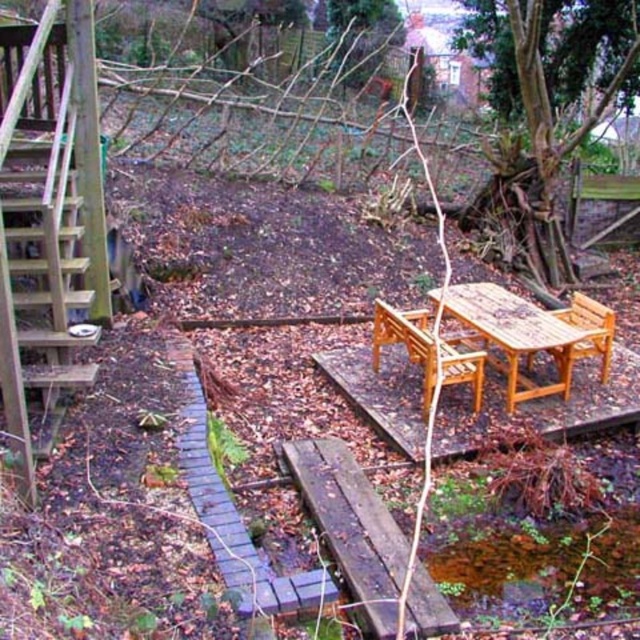
Which is in front, point (376, 333) or point (588, 312)?

Positioned in front is point (376, 333).

Measure the distance from wooden chair at center to light brown wooden chair at center.

wooden chair at center is 3.88 feet away from light brown wooden chair at center.

The height and width of the screenshot is (640, 640). Identify the location of wooden chair at center. (406, 340).

Image resolution: width=640 pixels, height=640 pixels. In order to click on wooden chair at center in this screenshot , I will do `click(406, 340)`.

Does light brown wooden table at center come in front of wooden chair at center?

No.

Which is below, light brown wooden table at center or wooden chair at center?

Positioned lower is wooden chair at center.

Does point (502, 289) lie behind point (403, 324)?

That is True.

At what (x,y) coordinates should I click in order to perform the action: click on light brown wooden table at center. Please return your answer as a coordinate pair (x, y). The width and height of the screenshot is (640, 640). Looking at the image, I should click on (513, 333).

Does brown rough tree at upper right appear over rusty wooden bench at center?

Yes, brown rough tree at upper right is above rusty wooden bench at center.

Image resolution: width=640 pixels, height=640 pixels. In order to click on brown rough tree at upper right in this screenshot , I will do `click(541, 106)`.

Is point (561, 38) positioned behind point (346, 493)?

Yes, point (561, 38) is behind point (346, 493).

Locate an element on the screen. Image resolution: width=640 pixels, height=640 pixels. brown rough tree at upper right is located at coordinates (541, 106).